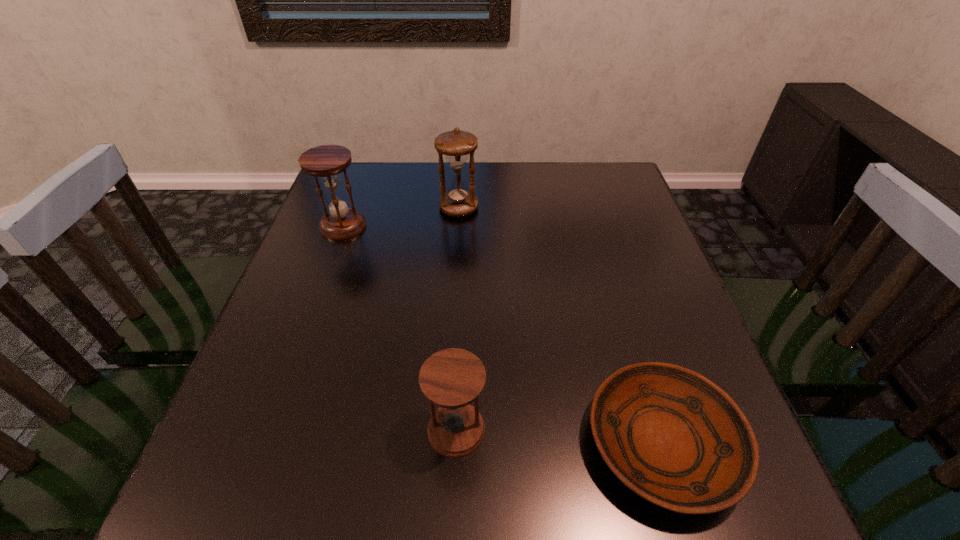
Locate an element on the screen. the leftmost hourglass is located at coordinates 326,161.

This screenshot has width=960, height=540. I want to click on the nearest hourglass, so click(452, 378).

Where is `the shortest hourglass`? Image resolution: width=960 pixels, height=540 pixels. the shortest hourglass is located at coordinates (452, 378).

Find the location of `the shortest object`. the shortest object is located at coordinates (673, 437).

This screenshot has width=960, height=540. Identify the location of plate. (673, 437).

The height and width of the screenshot is (540, 960). Identify the location of vacant space located on the right of the leftmost hourglass. (512, 226).

This screenshot has height=540, width=960. In order to click on free spot located 0.060m on the front of the shortest hourglass in this screenshot , I will do `click(454, 497)`.

Locate an element on the screen. The image size is (960, 540). free space located 0.170m on the left of the shortest object is located at coordinates (484, 444).

In order to click on object located in the far edge section of the desktop in this screenshot , I will do `click(460, 200)`.

Locate an element on the screen. object that is at the near edge is located at coordinates (673, 437).